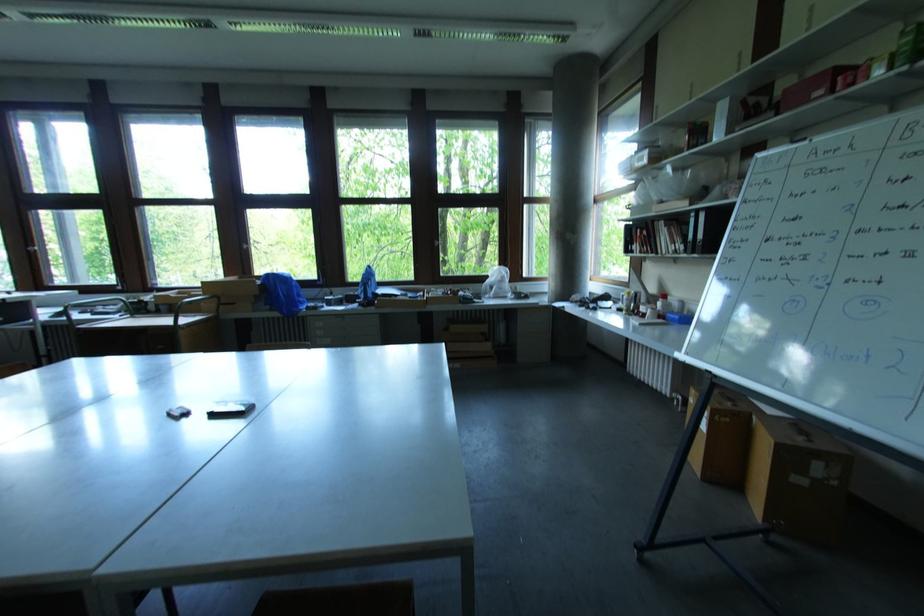
The width and height of the screenshot is (924, 616). Identify the location of black binder. (229, 408).